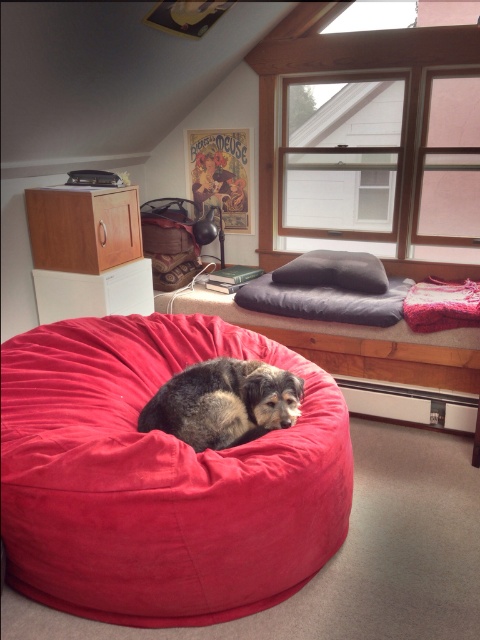
Consider the image. You are standing in the room and want to take a photo of the point marked at coordinates (316, 564). If your camera has a focal length of 50mm and you are currently 6.15 feet away from the point, is the point within the camera field of view? Assume the camera has a 46 degree diagonal field of view.

The point marked at coordinates (316, 564) is 6.15 feet from the camera. To determine if it is within the 46 degree diagonal field of view, calculate the maximum distance the point can be from the camera center while still being within the field of view. However, without knowing the exact position of the point relative to the camera axis or the dimensions of the scene, it is impossible to definitively confirm if the point is within the field of view based on the given information.

You are trying to decide whether to place a new rectangular toy box between the fluffy brown dog at center and the dark gray plush pillow at upper center. The toy box is 1.2 meters wide. Can the toy box fit between them without overlapping either object?

The fluffy brown dog at center has a lesser width compared to the dark gray plush pillow at upper center. Since the toy box is 1.2 meters wide, but the exact distance between them isn

You are planning to place a small table next to the fluffy brown dog at center. Based on the dog

The fluffy brown dog at center is located at point [224,403], so you should place the table near that coordinate to ensure it is next to the dog.